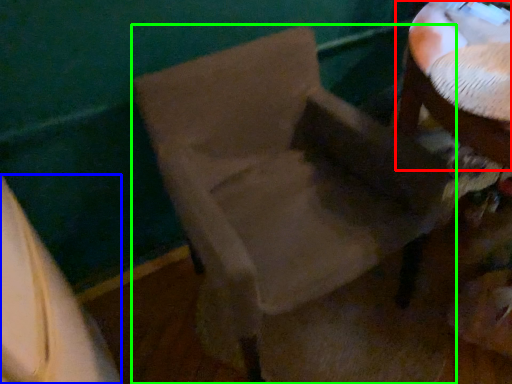
Question: Considering the real-world distances, which object is closest to table (highlighted by a red box)? leftover (highlighted by a blue box) or chair (highlighted by a green box).

Choices:
 (A) leftover
 (B) chair

Answer: (B)